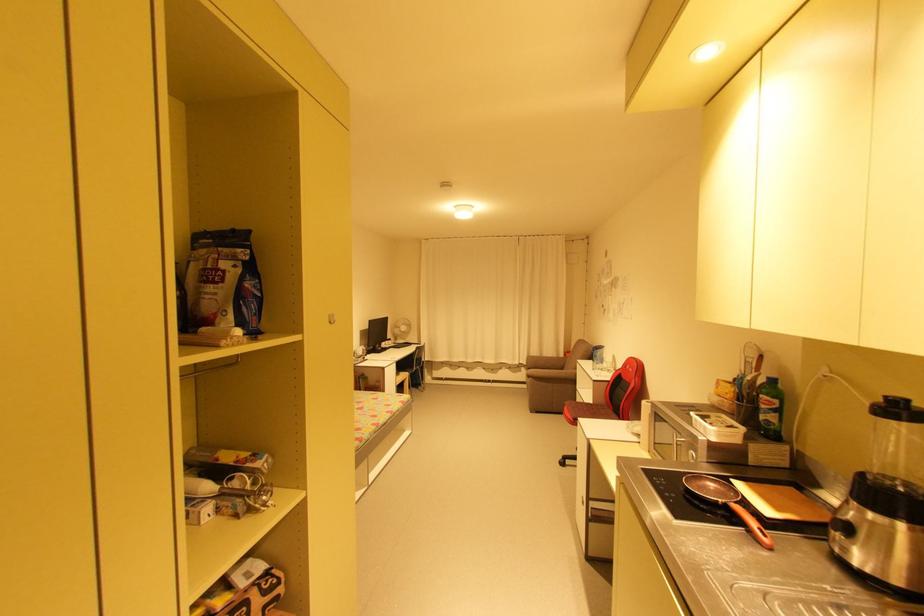
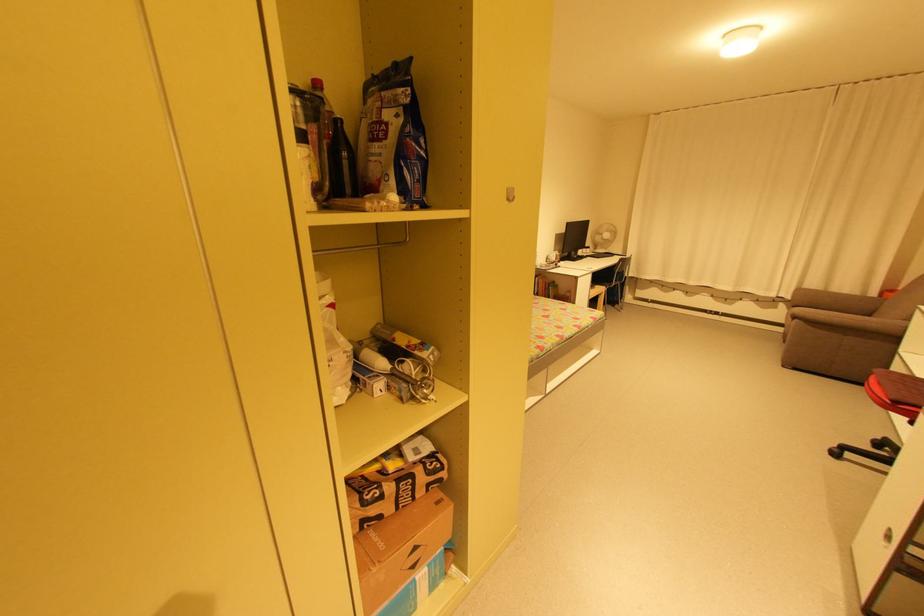
Question: I am providing you with two images of the same scene from different viewpoints. Please identify which objects are invisible in image2.

Choices:
 (A) white light switch
 (B) brown cardboard box
 (C) brown sofa sitting surface
 (D) none of these

Answer: (D)